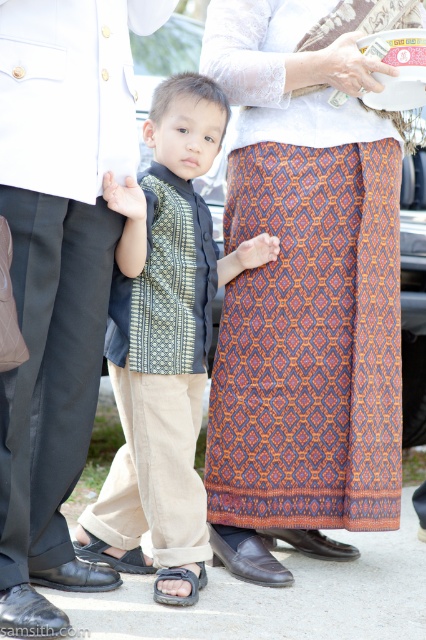
You are planning to take a photo of the matte black suit at center. Based on its position, where should you aim your camera to capture it properly?

The matte black suit at center is located at point coordinates (58, 272), so aim your camera at those coordinates to capture it properly.